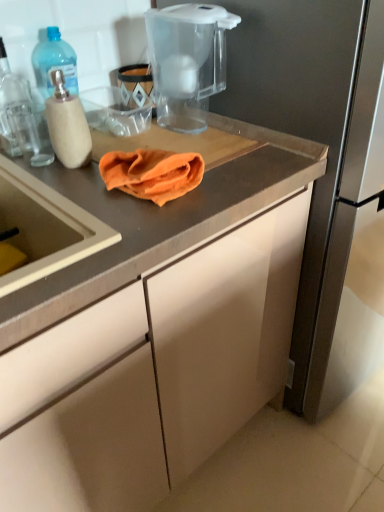
The height and width of the screenshot is (512, 384). In order to click on free point in front of orange cloth at center in this screenshot , I will do `click(133, 229)`.